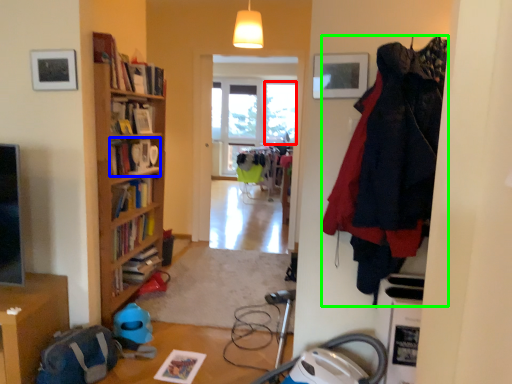
Question: Which object is the closest to the window (highlighted by a red box)? Choose among these: book (highlighted by a blue box) or clothing (highlighted by a green box).

Choices:
 (A) book
 (B) clothing

Answer: (A)